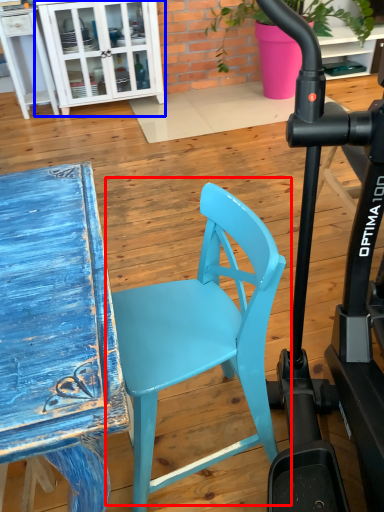
Question: Which object appears closest to the camera in this image, chair (highlighted by a red box) or cabinetry (highlighted by a blue box)?

Choices:
 (A) chair
 (B) cabinetry

Answer: (A)